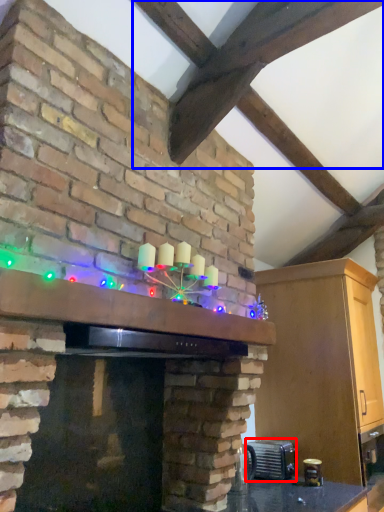
Question: Which point is closer to the camera, appliance (highlighted by a red box) or exhaust hood (highlighted by a blue box)?

Choices:
 (A) appliance
 (B) exhaust hood

Answer: (B)